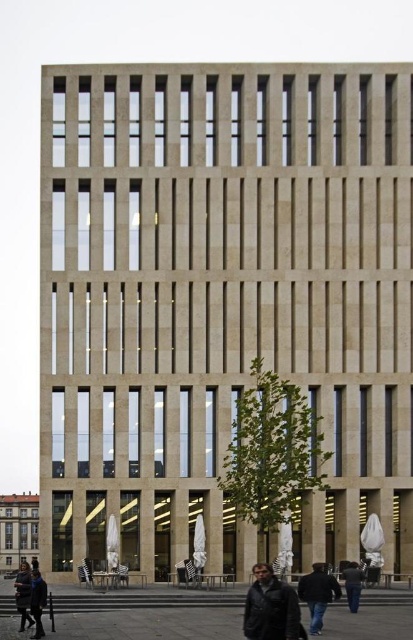
Question: Which point is closer to the camera taking this photo?

Choices:
 (A) (349, 564)
 (B) (311, 628)
 (C) (21, 593)

Answer: (B)

Question: Does dark brown leather jacket at lower left appear under dark gray jacket at lower center?

Choices:
 (A) yes
 (B) no

Answer: (A)

Question: Which object is positioned closest to the dark gray leather jacket at lower center?

Choices:
 (A) dark gray jacket at lower center
 (B) dark blue jacket at center
 (C) dark blue leather jacket at lower left
 (D) dark brown leather jacket at lower left

Answer: (B)

Question: Which object is closer to the camera taking this photo?

Choices:
 (A) dark blue jacket at center
 (B) dark gray jacket at lower center
 (C) dark gray leather jacket at lower center

Answer: (C)

Question: Does dark blue jacket at center have a larger size compared to dark blue leather jacket at lower left?

Choices:
 (A) yes
 (B) no

Answer: (A)

Question: Does dark blue leather jacket at lower left have a greater width compared to dark gray jacket at lower center?

Choices:
 (A) no
 (B) yes

Answer: (A)